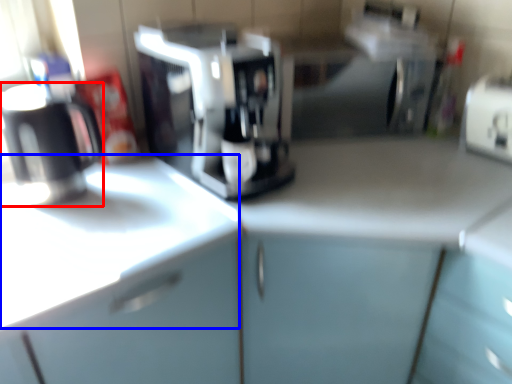
Question: Among these objects, which one is nearest to the camera, kitchen appliance (highlighted by a red box) or counter top (highlighted by a blue box)?

Choices:
 (A) kitchen appliance
 (B) counter top

Answer: (B)